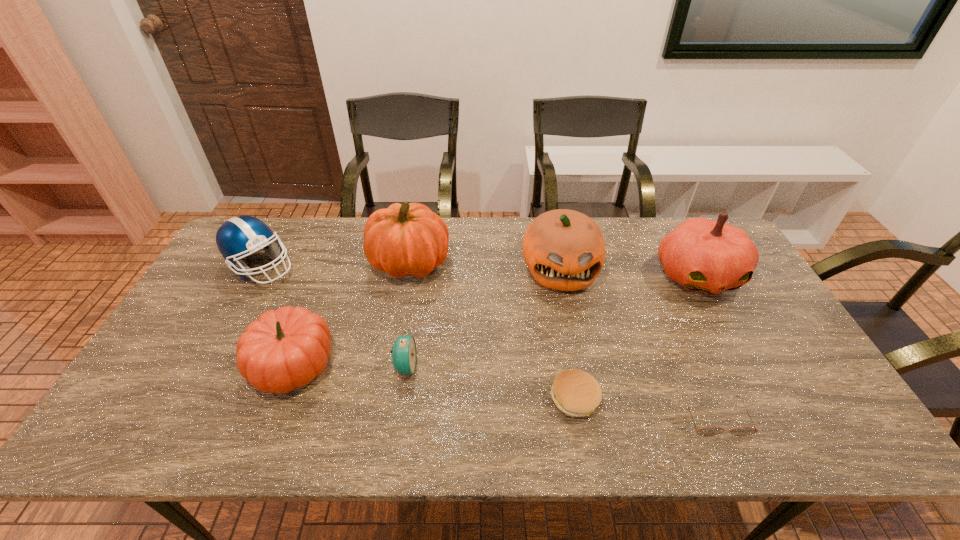
Where is `blank area in the image that satisfies the following two spatial constraints: 1. on the face of the second pumpkin from right to left; 2. on the front-facing side of the alarm clock`? This screenshot has width=960, height=540. blank area in the image that satisfies the following two spatial constraints: 1. on the face of the second pumpkin from right to left; 2. on the front-facing side of the alarm clock is located at coordinates (579, 367).

Where is `free space that satisfies the following two spatial constraints: 1. on the face of the third pumpkin from left to right; 2. on the front-facing side of the alarm clock`? This screenshot has height=540, width=960. free space that satisfies the following two spatial constraints: 1. on the face of the third pumpkin from left to right; 2. on the front-facing side of the alarm clock is located at coordinates (579, 367).